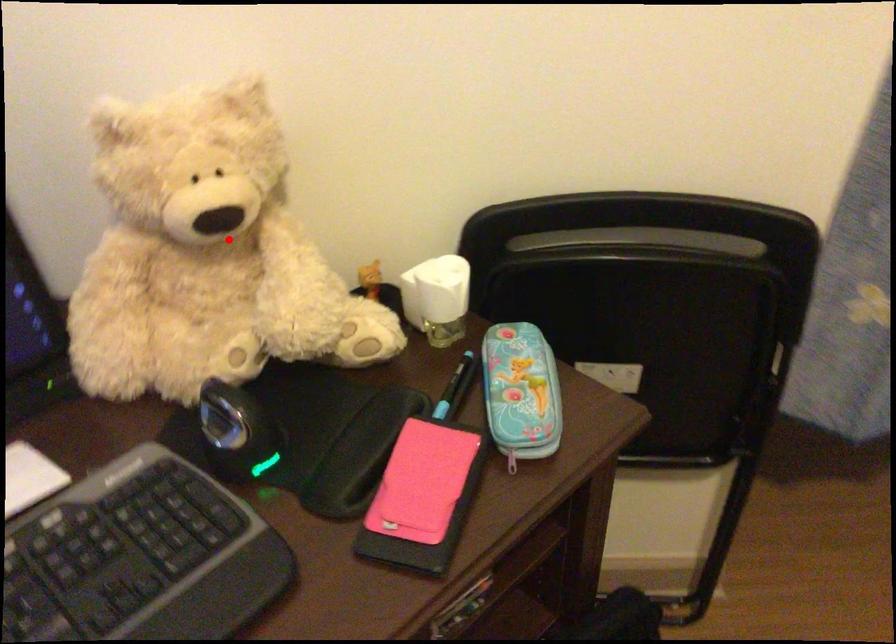
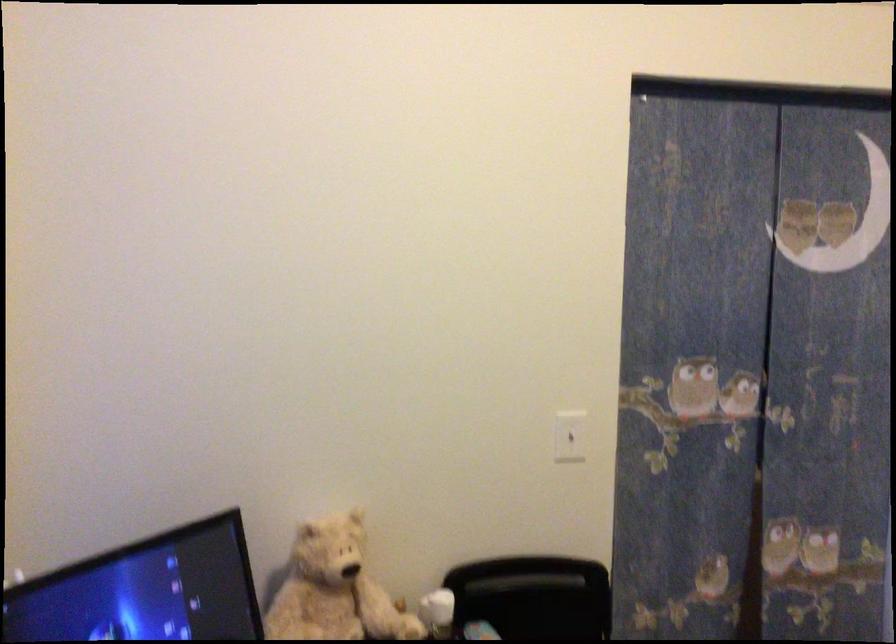
Question: I am providing you with two images of the same scene from different viewpoints. A red point is shown in image1. For the corresponding object point in image2, is it positioned nearer or farther from the camera?

Choices:
 (A) Nearer
 (B) Farther

Answer: (B)